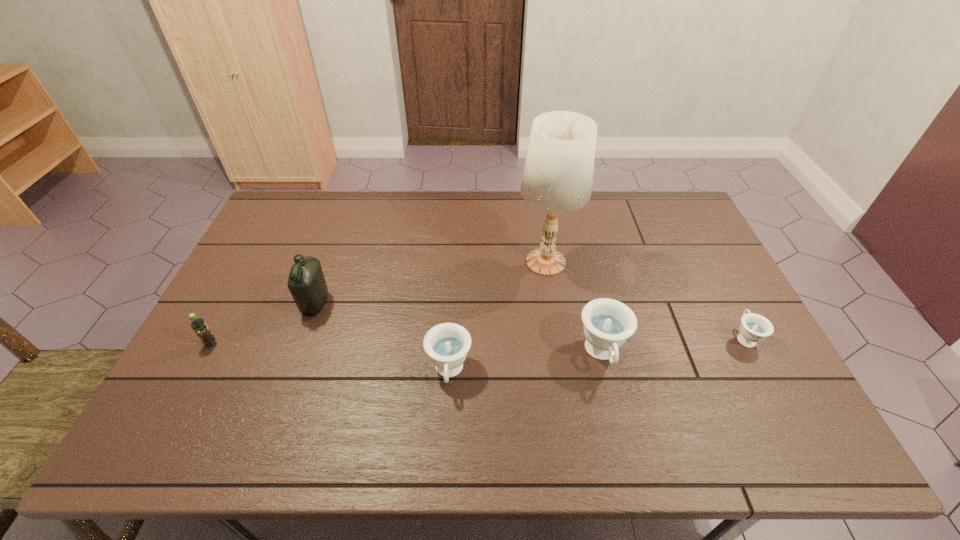
Find the location of a particular element. Image resolution: width=960 pixels, height=540 pixels. blank space located on the side of the rightmost object with the handle is located at coordinates (699, 251).

Find the location of a particular element. The image size is (960, 540). vacant area located on the side of the rightmost object with the handle is located at coordinates (714, 279).

I want to click on vacant area located 0.080m on the side of the rightmost object with the handle, so pos(726,301).

You are a GUI agent. You are given a task and a screenshot of the screen. Output one action in this format:
    pyautogui.click(x=<x>, y=<y>)
    Task: Click on the vacant space located on the front of the bottle
    
    Given the screenshot: What is the action you would take?
    pyautogui.click(x=279, y=408)

Where is `vacant point located 0.110m on the left of the farthest object`? vacant point located 0.110m on the left of the farthest object is located at coordinates (480, 262).

Locate an element on the screen. object that is positioned at the left edge is located at coordinates (198, 324).

I want to click on object that is positioned at the right edge, so click(754, 328).

Identify the location of vacant space at the far edge. (423, 219).

At what (x,y) coordinates should I click in order to perform the action: click on vacant region at the near edge of the desktop. Please return your answer as a coordinate pair (x, y). Looking at the image, I should click on (599, 379).

Locate an element on the screen. Image resolution: width=960 pixels, height=540 pixels. vacant space at the left edge of the desktop is located at coordinates (237, 353).